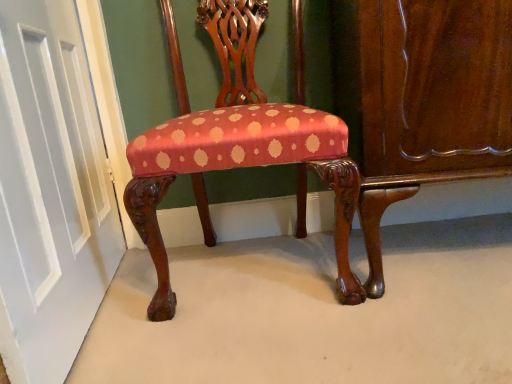
Question: From the image's perspective, is silky red fabric chair at center located above or below white painted wood door at left?

Choices:
 (A) above
 (B) below

Answer: (A)

Question: In terms of size, does silky red fabric chair at center appear bigger or smaller than white painted wood door at left?

Choices:
 (A) big
 (B) small

Answer: (A)

Question: Which of these objects is positioned closest to the white painted wood door at left?

Choices:
 (A) glossy wood dresser at lower right
 (B) silky red fabric chair at center

Answer: (B)

Question: Considering the real-world distances, which object is closest to the silky red fabric chair at center?

Choices:
 (A) glossy wood dresser at lower right
 (B) white painted wood door at left

Answer: (A)